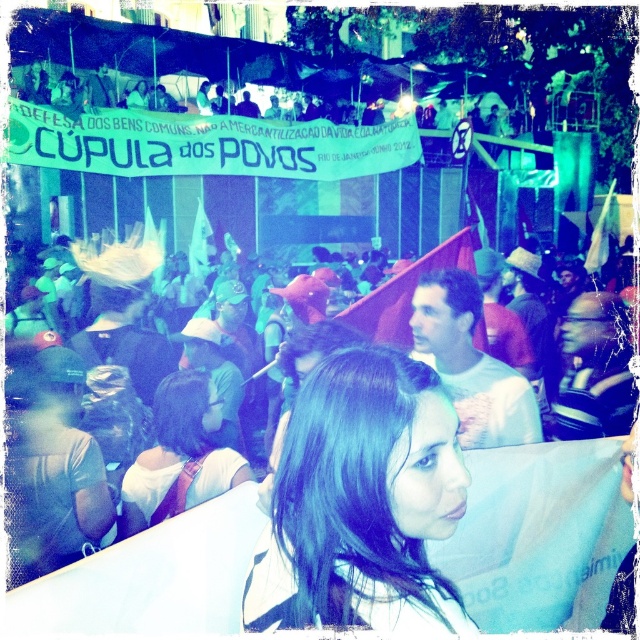
Is point (403, 396) positioned after point (474, 385)?

No, it is not.

Between dark brown hair at center and white matte shirt at center, which one has less height?

dark brown hair at center

Who is more distant from viewer, (449,516) or (461,339)?

The point (461,339) is more distant.

Image resolution: width=640 pixels, height=640 pixels. In order to click on dark brown hair at center in this screenshot , I will do `click(362, 502)`.

Between point (436, 364) and point (600, 317), which one is positioned behind?

Point (600, 317)

Is white matte shirt at center further to camera compared to matte black glasses at center?

No, it is in front of matte black glasses at center.

Where is `white matte shirt at center`? Image resolution: width=640 pixels, height=640 pixels. white matte shirt at center is located at coordinates (470, 364).

I want to click on white matte shirt at center, so click(x=470, y=364).

Does dark brown hair at center appear over matte brown hair at center?

Yes, dark brown hair at center is above matte brown hair at center.

Is dark brown hair at center to the right of matte brown hair at center from the viewer's perspective?

Indeed, dark brown hair at center is positioned on the right side of matte brown hair at center.

I want to click on dark brown hair at center, so click(x=362, y=502).